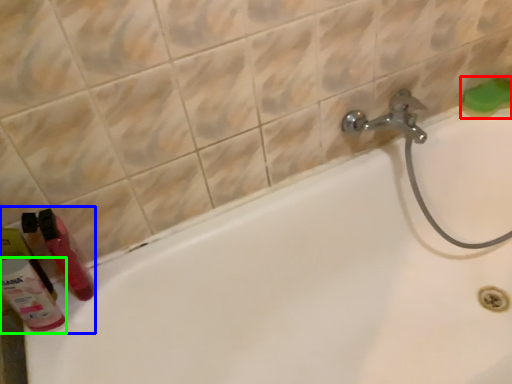
Question: Based on their relative distances, which object is farther from soap (highlighted by a red box)? Choose from toiletry (highlighted by a blue box) and cleaning product (highlighted by a green box).

Choices:
 (A) toiletry
 (B) cleaning product

Answer: (B)